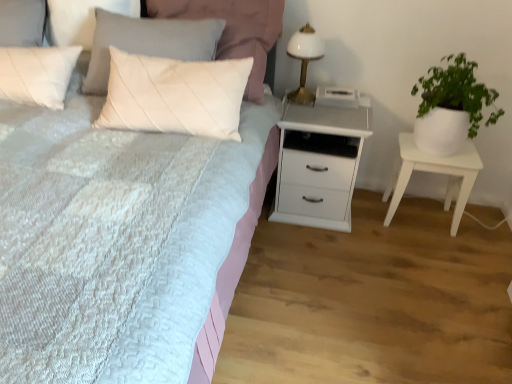
Question: Is point (293, 155) positioned closer to the camera than point (126, 350)?

Choices:
 (A) closer
 (B) farther

Answer: (B)

Question: From a real-world perspective, is white wood chest of drawers at center above or below white textured bed at center?

Choices:
 (A) below
 (B) above

Answer: (A)

Question: Considering the real-world distances, which object is closest to the white wood chest of drawers at center?

Choices:
 (A) white quilted pillow at upper center
 (B) white textured bed at center
 (C) green leafy plant in white pot at right
 (D) white glossy table lamp at upper right
 (E) white matte nightstand at right

Answer: (D)

Question: Estimate the real-world distances between objects in this image. Which object is closer to the white matte nightstand at right?

Choices:
 (A) white quilted pillow at upper center
 (B) white wood chest of drawers at center
 (C) white textured bed at center
 (D) green leafy plant in white pot at right
 (E) white glossy table lamp at upper right

Answer: (D)